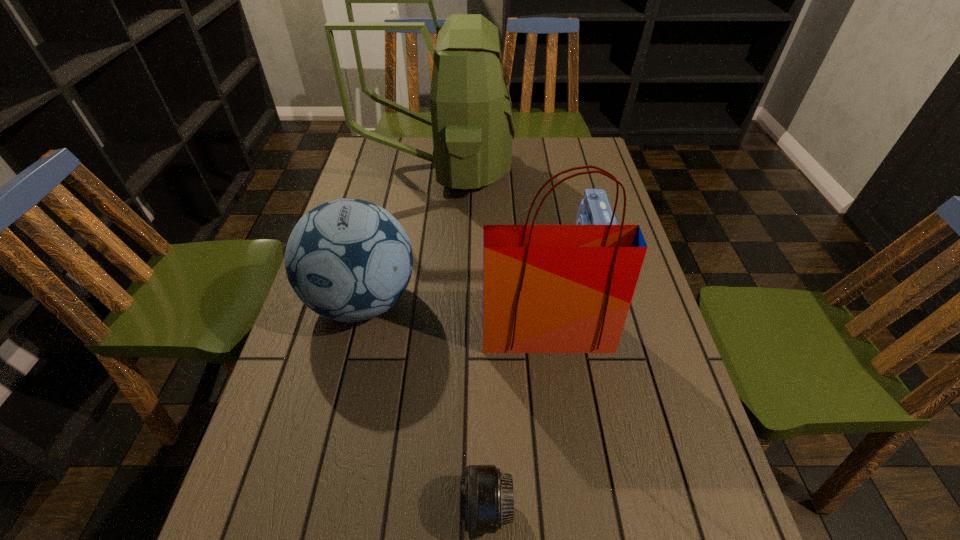
You are a GUI agent. You are given a task and a screenshot of the screen. Output one action in this format:
    pyautogui.click(x=<x>, y=<y>)
    Task: Click on the vacant space that is in between the third tallest object and the shopping bag
    This screenshot has width=960, height=540.
    Given the screenshot: What is the action you would take?
    pyautogui.click(x=455, y=317)

Where is `free spot between the third shortest object and the fourth tallest object`? free spot between the third shortest object and the fourth tallest object is located at coordinates (477, 272).

I want to click on vacant area that lies between the backpack and the camera, so click(516, 207).

This screenshot has height=540, width=960. In order to click on object that is the third closest to the shortest object in this screenshot , I will do `click(594, 209)`.

Locate which object ranks in proximity to the shortest object. Please provide its 2D coordinates. Your answer should be formatted as a tuple, i.e. [(x, y)], where the tuple contains the x and y coordinates of a point satisfying the conditions above.

[(546, 288)]

The width and height of the screenshot is (960, 540). In order to click on vacant region that satisfies the following two spatial constraints: 1. on the lens of the camera; 2. on the handle side of the shopping bag in this screenshot , I will do `click(614, 333)`.